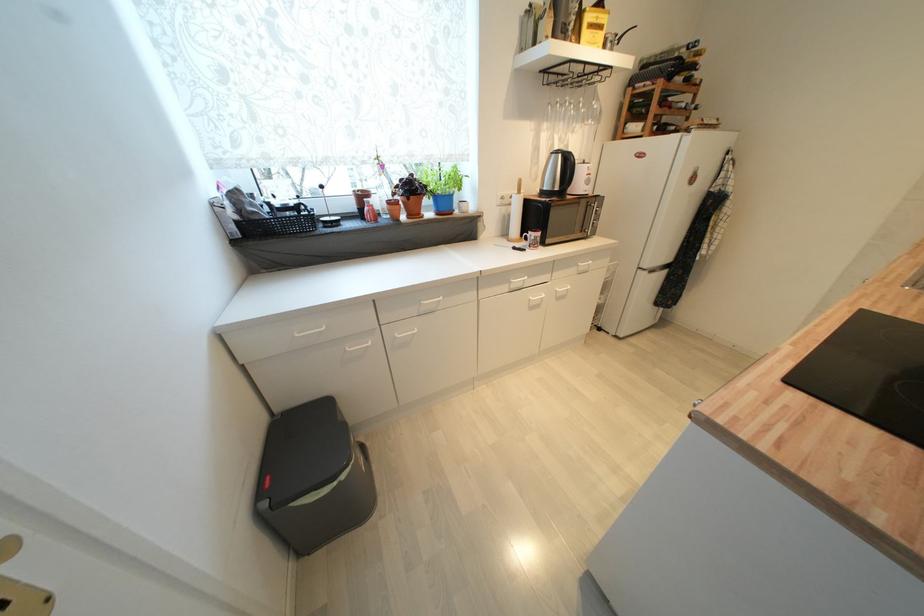
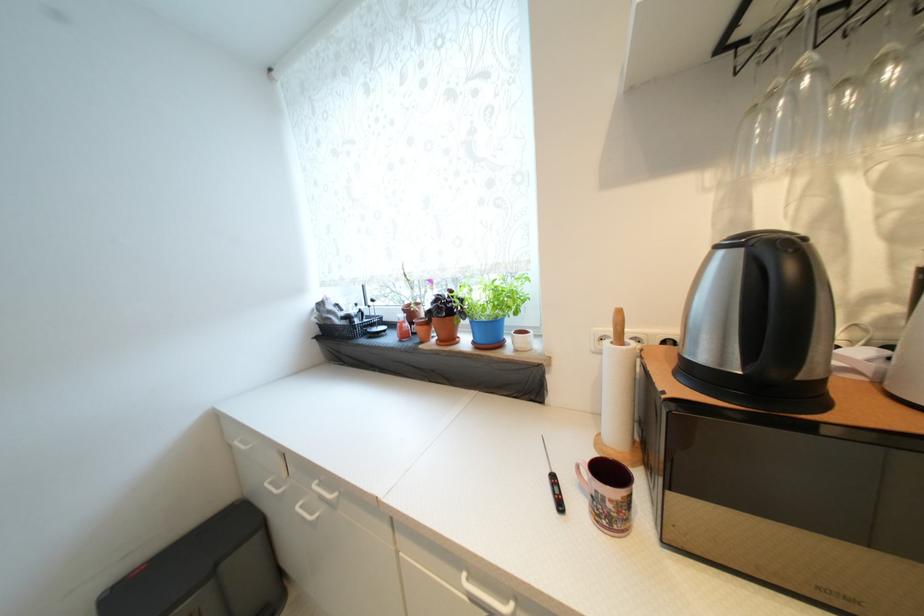
Locate, in the second image, the point that corresponds to point (415, 219) in the first image.

(445, 342)